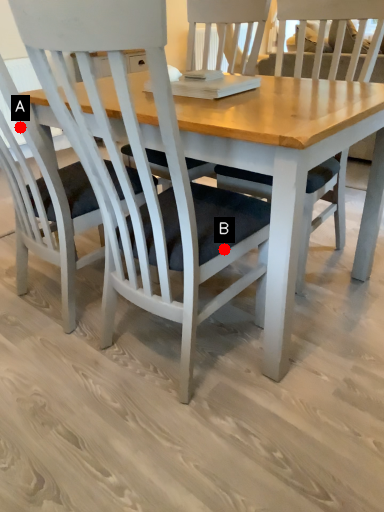
Question: Two points are circled on the image, labeled by A and B beside each circle. Which point appears closest to the camera in this image?

Choices:
 (A) A is closer
 (B) B is closer

Answer: (B)